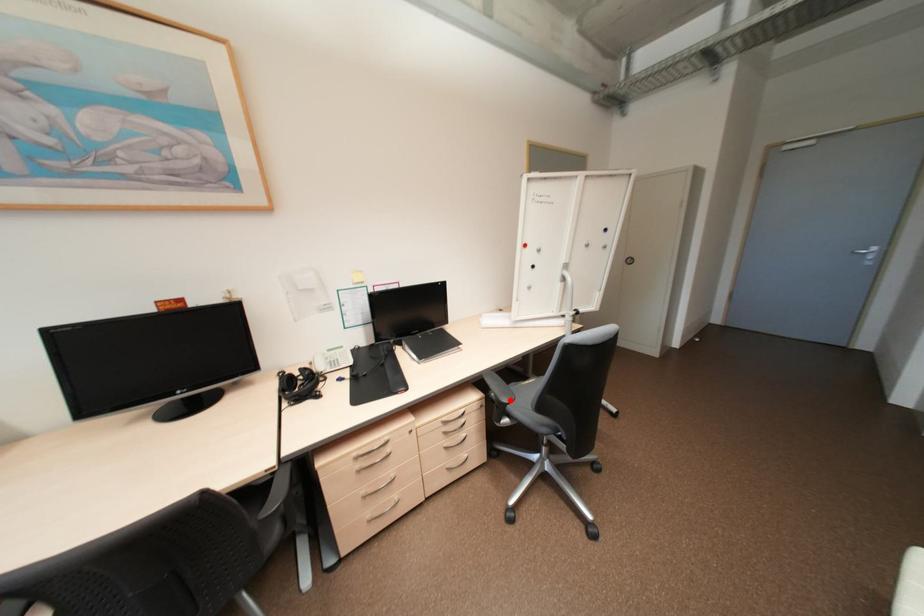
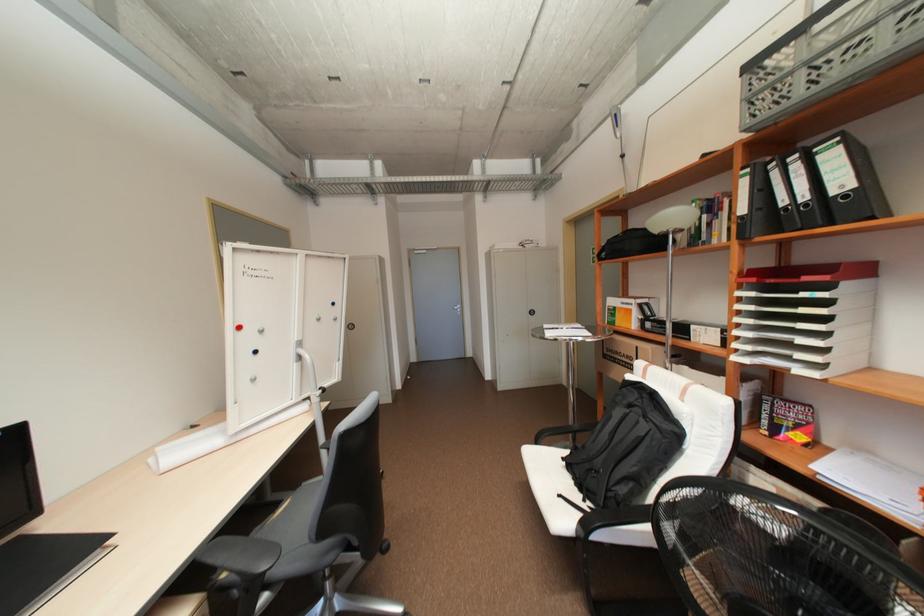
Locate, in the second image, the point that corresponds to the highlighted location in the first image.

(270, 567)